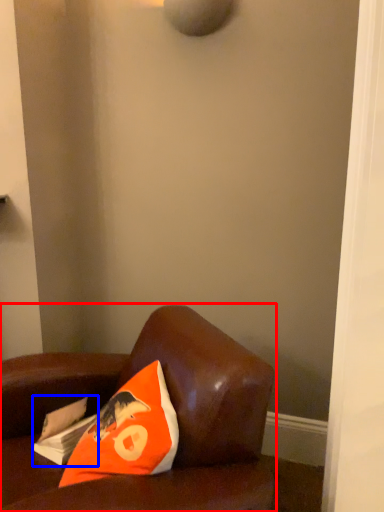
Question: Which point is closer to the camera, furniture (highlighted by a red box) or magazine (highlighted by a blue box)?

Choices:
 (A) furniture
 (B) magazine

Answer: (A)